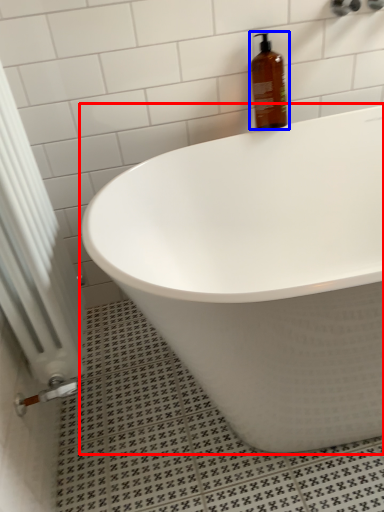
Question: Which point is further to the camera, bathtub (highlighted by a red box) or bottle (highlighted by a blue box)?

Choices:
 (A) bathtub
 (B) bottle

Answer: (B)